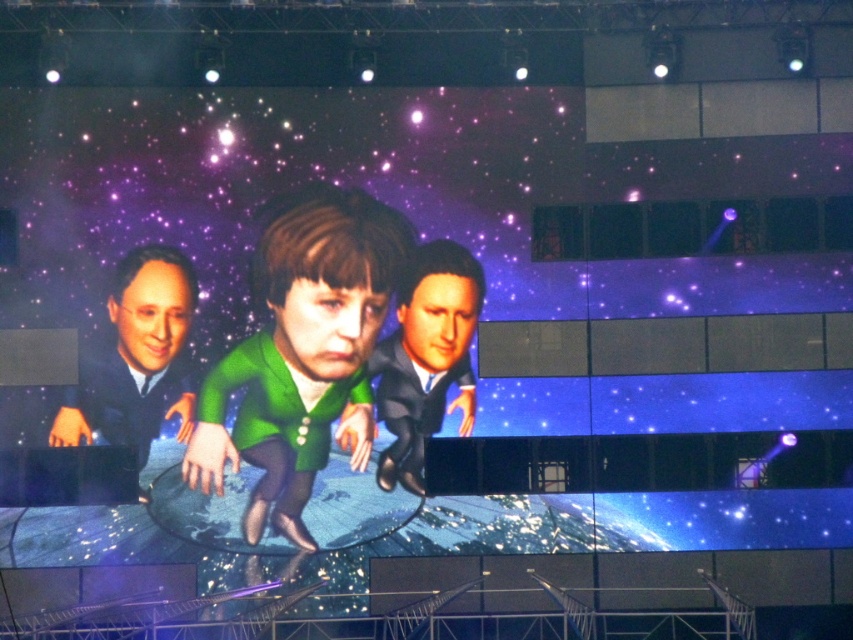
Is green matte jacket at center positioned before smooth black suit at center?

Yes, it is.

The height and width of the screenshot is (640, 853). I want to click on green matte jacket at center, so click(x=302, y=353).

Between matte black suit at left and smooth black suit at center, which one appears on the left side from the viewer's perspective?

From the viewer's perspective, matte black suit at left appears more on the left side.

Based on the photo, is matte black suit at left smaller than smooth black suit at center?

Actually, matte black suit at left might be larger than smooth black suit at center.

Who is more distant from viewer, [68,435] or [387,483]?

The point [68,435] is more distant.

You are a GUI agent. You are given a task and a screenshot of the screen. Output one action in this format:
    pyautogui.click(x=<x>, y=<y>)
    Task: Click on the matte black suit at left
    The width and height of the screenshot is (853, 640).
    Given the screenshot: What is the action you would take?
    pyautogui.click(x=136, y=356)

Between green matte jacket at center and matte black suit at left, which one has more height?

green matte jacket at center is taller.

Is point (310, 472) farther from camera compared to point (113, 308)?

No, (310, 472) is closer to viewer.

Where is `green matte jacket at center`? green matte jacket at center is located at coordinates (302, 353).